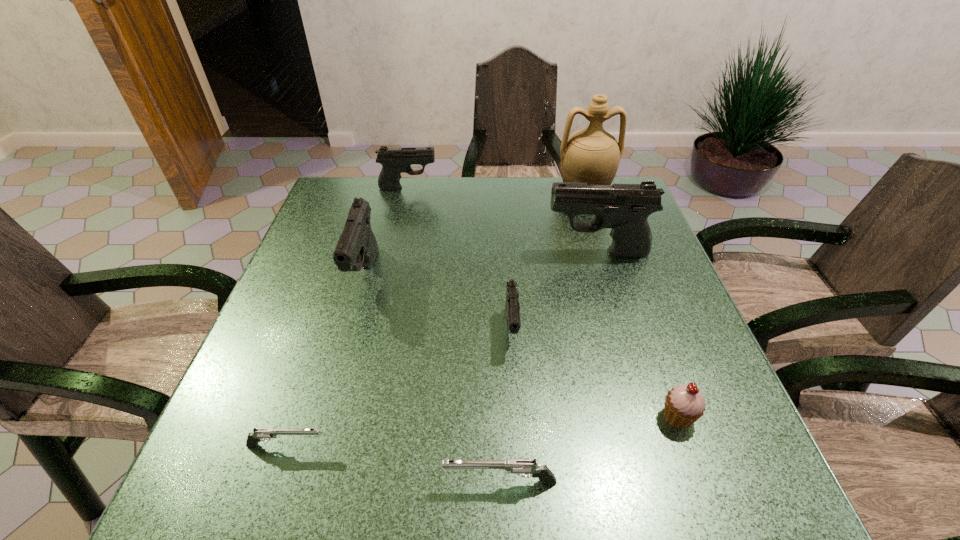
Point out which pistol is positioned as the nearest to the smallest black pistol. Please provide its 2D coordinates. Your answer should be formatted as a tuple, i.e. [(x, y)], where the tuple contains the x and y coordinates of a point satisfying the conditions above.

[(625, 208)]

Image resolution: width=960 pixels, height=540 pixels. I want to click on black pistol that is the fourth closest to the tallest object, so click(x=357, y=247).

This screenshot has height=540, width=960. I want to click on black pistol that is the nearest to the third shortest pistol, so click(x=625, y=208).

The height and width of the screenshot is (540, 960). In order to click on vacant space that satisfies the following two spatial constraints: 1. at the barrel of the second tallest pistol; 2. on the front-facing side of the seventh farthest object in this screenshot , I will do `click(318, 446)`.

This screenshot has width=960, height=540. I want to click on free space in the image that satisfies the following two spatial constraints: 1. on the front side of the tallest object; 2. on the front-facing side of the bigger silver pistol, so click(x=676, y=482).

This screenshot has width=960, height=540. What are the coordinates of `free location that satisfies the following two spatial constraints: 1. at the barrel of the third tallest object; 2. on the front-facing side of the shortest pistol` in the screenshot? It's located at (318, 446).

The width and height of the screenshot is (960, 540). Identify the location of free space in the image that satisfies the following two spatial constraints: 1. at the barrel of the third shortest pistol; 2. on the front-facing side of the second shortest pistol. pos(522,482).

You are a GUI agent. You are given a task and a screenshot of the screen. Output one action in this format:
    pyautogui.click(x=<x>, y=<y>)
    Task: Click on the vacant space that satisfies the following two spatial constraints: 1. at the barrel of the rightmost black pistol; 2. on the left side of the third nearest object
    
    Given the screenshot: What is the action you would take?
    pyautogui.click(x=647, y=416)